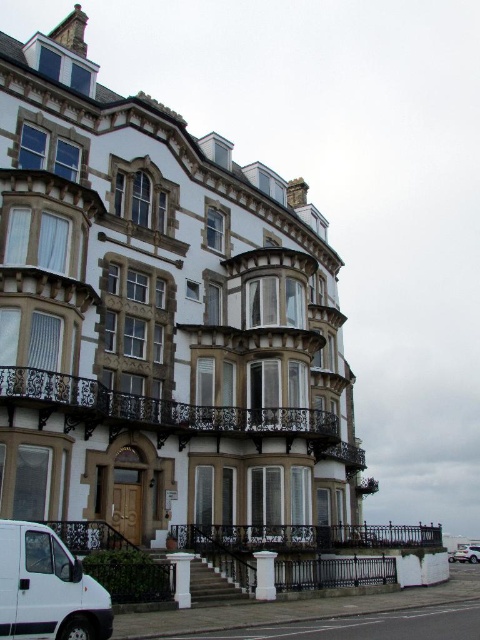
Looking at this image, you are a delivery driver who needs to park your white matte van at lower left as close as possible to the dark brown wrought iron balcony at center for unloading. Based on the scene, can you park the van directly in front of the balcony?

The dark brown wrought iron balcony at center is positioned on the right side of the white matte van at lower left, meaning the van cannot be parked directly in front of the balcony since it is already positioned to its right. You may need to adjust your parking spot to align better with the balcony.

From the picture: You are a delivery person approaching the building and need to park your white matte suv at lower right. There is a dark brown wrought iron balcony at center that might block the parking spot. Can you park your suv without hitting the balcony?

The dark brown wrought iron balcony at center is positioned on the left side of white matte suv at lower right, so the balcony is not in the path of the parking spot. You can park your suv safely without hitting the balcony.